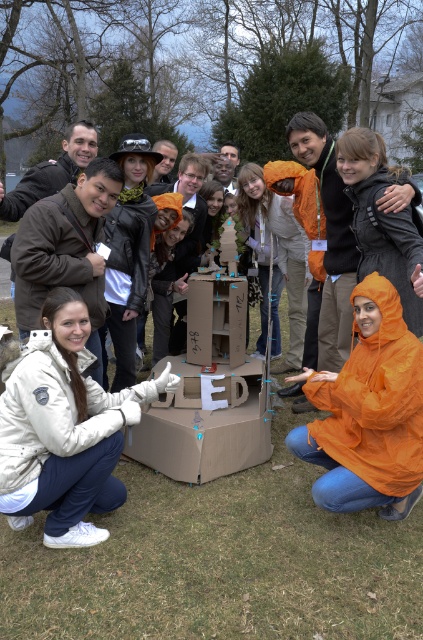
Question: Which of the following is the farthest from the observer?

Choices:
 (A) cardboard box at center
 (B) white fleece jacket at lower left
 (C) orange waterproof jacket at lower center

Answer: (A)

Question: Can you confirm if white fleece jacket at lower left is smaller than cardboard box at center?

Choices:
 (A) yes
 (B) no

Answer: (B)

Question: Where is white fleece jacket at lower left located in relation to cardboard box at center in the image?

Choices:
 (A) left
 (B) right

Answer: (A)

Question: Estimate the real-world distances between objects in this image. Which object is farther from the white fleece jacket at lower left?

Choices:
 (A) orange waterproof jacket at lower center
 (B) cardboard box at center

Answer: (A)

Question: Is white fleece jacket at lower left behind cardboard box at center?

Choices:
 (A) no
 (B) yes

Answer: (A)

Question: Which point is closer to the camera?

Choices:
 (A) orange waterproof jacket at lower center
 (B) cardboard box at center
 (C) white fleece jacket at lower left

Answer: (C)